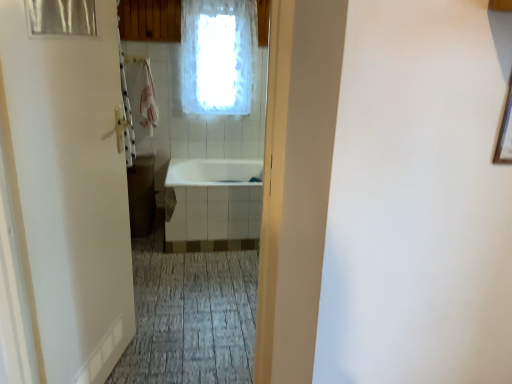
Question: Is there a large distance between white glossy bathtub at center and transparent plastic shower curtain at upper left?

Choices:
 (A) yes
 (B) no

Answer: (A)

Question: From a real-world perspective, is white glossy bathtub at center on top of transparent plastic shower curtain at upper left?

Choices:
 (A) yes
 (B) no

Answer: (B)

Question: Is white glossy bathtub at center wider than transparent plastic shower curtain at upper left?

Choices:
 (A) no
 (B) yes

Answer: (B)

Question: From the image's perspective, would you say white glossy bathtub at center is shown under transparent plastic shower curtain at upper left?

Choices:
 (A) yes
 (B) no

Answer: (A)

Question: Is white glossy bathtub at center bigger than transparent plastic shower curtain at upper left?

Choices:
 (A) no
 (B) yes

Answer: (B)

Question: Relative to white matte door at left, is white frosted glass window at upper center in front or behind?

Choices:
 (A) front
 (B) behind

Answer: (B)

Question: From a real-world perspective, is white frosted glass window at upper center positioned above or below white matte door at left?

Choices:
 (A) above
 (B) below

Answer: (A)

Question: From the image's perspective, is white frosted glass window at upper center positioned above or below white matte door at left?

Choices:
 (A) below
 (B) above

Answer: (B)

Question: Does point (245, 36) appear closer or farther from the camera than point (93, 208)?

Choices:
 (A) closer
 (B) farther

Answer: (B)

Question: From a real-world perspective, is white frosted glass window at upper center positioned above or below transparent plastic shower curtain at upper left?

Choices:
 (A) below
 (B) above

Answer: (A)

Question: Is point (238, 102) closer or farther from the camera than point (33, 3)?

Choices:
 (A) farther
 (B) closer

Answer: (A)

Question: Relative to transparent plastic shower curtain at upper left, is white frosted glass window at upper center in front or behind?

Choices:
 (A) behind
 (B) front

Answer: (A)

Question: Is white frosted glass window at upper center taller or shorter than transparent plastic shower curtain at upper left?

Choices:
 (A) tall
 (B) short

Answer: (A)

Question: From the image's perspective, is white matte door at left located above or below white frosted glass window at upper center?

Choices:
 (A) below
 (B) above

Answer: (A)

Question: Considering the relative positions of white matte door at left and white frosted glass window at upper center in the image provided, is white matte door at left to the left or to the right of white frosted glass window at upper center?

Choices:
 (A) right
 (B) left

Answer: (B)